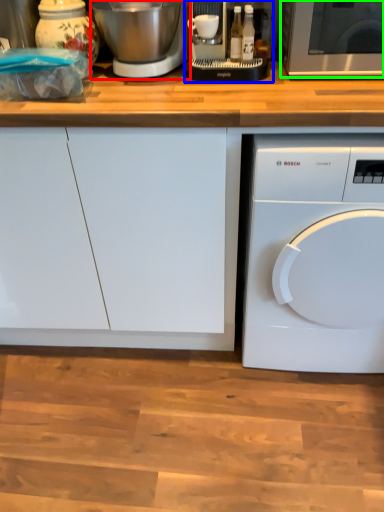
Question: Considering the real-world distances, which object is farthest from mixer (highlighted by a red box)? food processor (highlighted by a blue box) or microwave oven (highlighted by a green box)?

Choices:
 (A) food processor
 (B) microwave oven

Answer: (B)